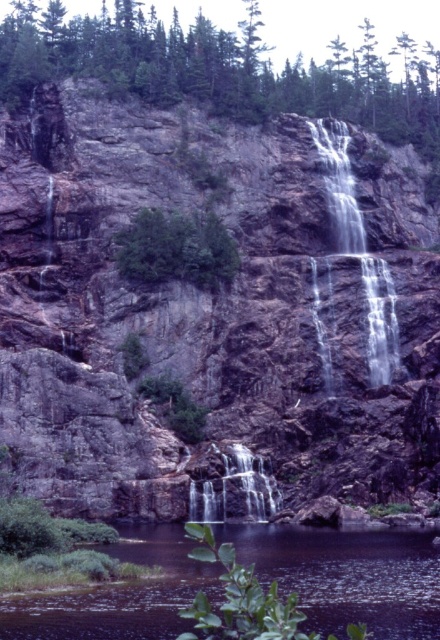
You are standing at the edge of the cliff overlooking the waterfall. You notice two areas of clear water in the scene. Which area of clear water at lower center or clear water at center is smaller in size?

The clear water at lower center is smaller than clear water at center.

You are a photographer planning to capture the waterfall scene. You want to ensure your camera can focus on both the clear water at center and the translucent white water at center. Given that your camera can only focus on objects within a 3 meter width, will both areas fit within this range?

The clear water at center is wider than the translucent white water at center. Since the camera can focus within a 3 meter width, and the total width of both areas combined would depend on their individual widths. However, the description only states that the clear water is wider, but not by how much. Without specific measurements, it is uncertain if both will fit within the 3 meter range.